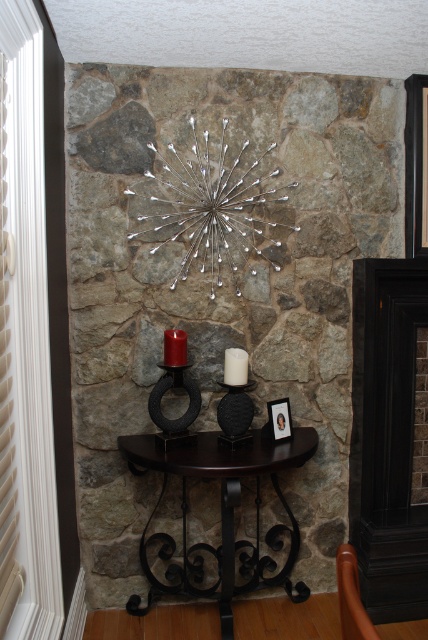
Question: Which of the following is the farthest from the observer?

Choices:
 (A) black matte fireplace at right
 (B) white matte candle at center
 (C) matte black candle holder at center
 (D) matte red candle at center

Answer: (A)

Question: From the image, what is the correct spatial relationship of dark wood table at center in relation to matte black candle holder at center?

Choices:
 (A) right
 (B) left

Answer: (B)

Question: Which object is farther from the camera taking this photo?

Choices:
 (A) matte red candle at center
 (B) matte black candle holder at center
 (C) black matte candle holder at center

Answer: (B)

Question: Considering the relative positions of dark wood table at center and matte red candle at center in the image provided, where is dark wood table at center located with respect to matte red candle at center?

Choices:
 (A) below
 (B) above

Answer: (A)

Question: Which object is positioned farthest from the white matte candle at center?

Choices:
 (A) matte black candle holder at center
 (B) dark wood table at center
 (C) matte red candle at center
 (D) black matte fireplace at right

Answer: (D)

Question: Is black matte fireplace at right to the left of matte black candle holder at center from the viewer's perspective?

Choices:
 (A) no
 (B) yes

Answer: (A)